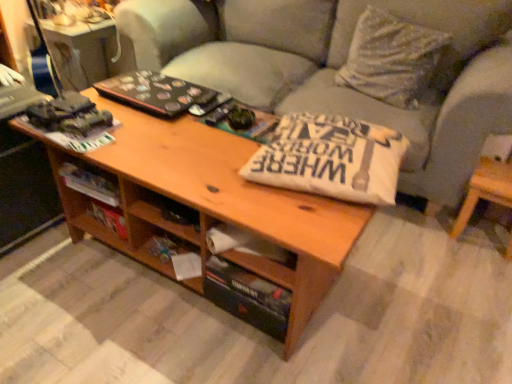
Question: From the image's perspective, is light brown wood side table at lower right located beneath wooden drawer at center?

Choices:
 (A) yes
 (B) no

Answer: (B)

Question: Is the surface of light brown wood side table at lower right in direct contact with wooden drawer at center?

Choices:
 (A) yes
 (B) no

Answer: (B)

Question: Is the depth of light brown wood side table at lower right greater than that of wooden drawer at center?

Choices:
 (A) yes
 (B) no

Answer: (A)

Question: From a real-world perspective, is light brown wood side table at lower right located higher than wooden drawer at center?

Choices:
 (A) yes
 (B) no

Answer: (B)

Question: Can wooden drawer at center be found inside light brown wood side table at lower right?

Choices:
 (A) no
 (B) yes

Answer: (A)

Question: Which is correct: white cotton pillow at center is inside wooden drawer at center, or outside of it?

Choices:
 (A) inside
 (B) outside

Answer: (B)

Question: From the image's perspective, is white cotton pillow at center above or below wooden drawer at center?

Choices:
 (A) above
 (B) below

Answer: (A)

Question: Considering the positions of white cotton pillow at center and wooden drawer at center in the image, is white cotton pillow at center taller or shorter than wooden drawer at center?

Choices:
 (A) tall
 (B) short

Answer: (A)

Question: Looking at their shapes, would you say white cotton pillow at center is wider or thinner than wooden drawer at center?

Choices:
 (A) wide
 (B) thin

Answer: (A)

Question: In terms of height, does white cotton pillow at center look taller or shorter compared to light brown wood side table at lower right?

Choices:
 (A) short
 (B) tall

Answer: (A)

Question: Is white cotton pillow at center to the left or to the right of light brown wood side table at lower right in the image?

Choices:
 (A) left
 (B) right

Answer: (A)

Question: Is white cotton pillow at center in front of or behind light brown wood side table at lower right in the image?

Choices:
 (A) behind
 (B) front

Answer: (B)

Question: Is white cotton pillow at center spatially inside light brown wood side table at lower right, or outside of it?

Choices:
 (A) inside
 (B) outside

Answer: (B)

Question: Considering the relative positions of light brown wood side table at lower right and white textured pillow at upper right in the image provided, is light brown wood side table at lower right to the left or to the right of white textured pillow at upper right?

Choices:
 (A) right
 (B) left

Answer: (A)

Question: Is light brown wood side table at lower right bigger or smaller than white textured pillow at upper right?

Choices:
 (A) big
 (B) small

Answer: (B)